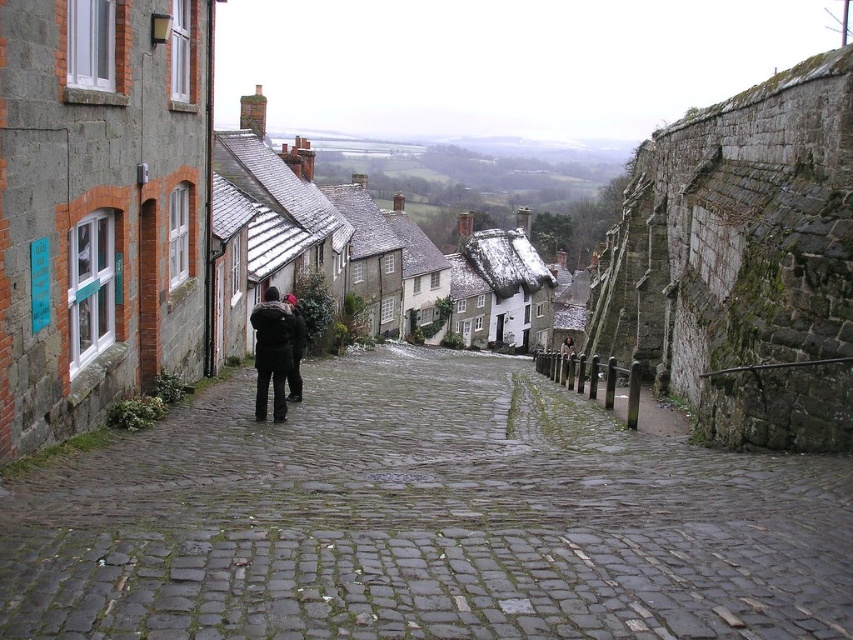
Consider the image. Does rough cobblestone alley at center appear on the right side of black fabric jacket at center?

Indeed, rough cobblestone alley at center is positioned on the right side of black fabric jacket at center.

Measure the distance from rough cobblestone alley at center to black fabric jacket at center.

Result: rough cobblestone alley at center and black fabric jacket at center are 10.85 meters apart.

Does point (456, 506) lie behind point (259, 419)?

No, it is in front of (259, 419).

Image resolution: width=853 pixels, height=640 pixels. I want to click on rough cobblestone alley at center, so (422, 522).

Who is positioned more to the right, black fabric jacket at center or dark brown leather jacket at center?

From the viewer's perspective, dark brown leather jacket at center appears more on the right side.

Is black fabric jacket at center bigger than dark brown leather jacket at center?

Indeed, black fabric jacket at center has a larger size compared to dark brown leather jacket at center.

Describe the element at coordinates (271, 352) in the screenshot. I see `black fabric jacket at center` at that location.

The width and height of the screenshot is (853, 640). In order to click on black fabric jacket at center in this screenshot , I will do `click(271, 352)`.

Is rough cobblestone alley at center below dark brown leather jacket at center?

Yes.

Who is more forward, (341, 381) or (297, 369)?

Point (297, 369) is more forward.

Measure the distance between point (555, 502) and camera.

23.63 meters

This screenshot has width=853, height=640. Identify the location of rough cobblestone alley at center. (422, 522).